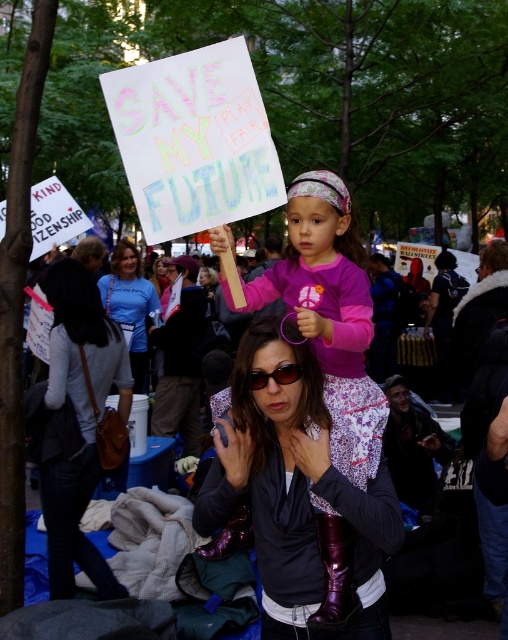
You are a photographer trying to capture the protest sign held by the girl. You notice two items at the center of your viewfinder, the pink fabric at center and the matte black sunglasses at center. Which item is wider in your current frame?

The pink fabric at center might be wider than matte black sunglasses at center.